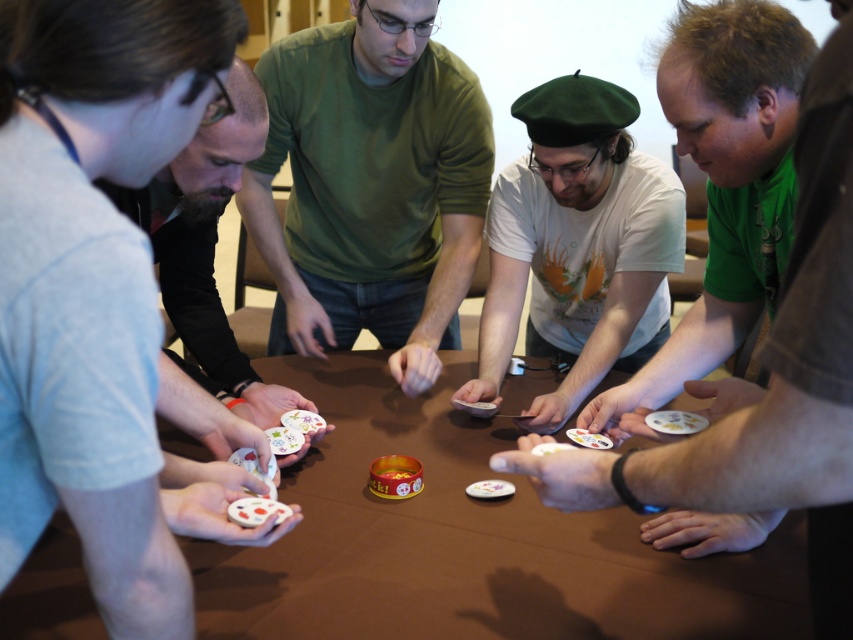
You are standing at the edge of the table and want to place a 1.2 meter long ruler from your current position to the point labeled point (386, 563). Will the ruler reach that point?

The distance between you and point (386, 563) is 1.08 meters, which is shorter than the ruler length of 1.2 meters. Therefore, the ruler will reach the point.

You are a person standing at the edge of the room looking towards the brown matte table at center and the smooth gray shirt at left. Which object is closer to the floor?

The brown matte table at center is shorter than the smooth gray shirt at left, so the brown matte table at center is closer to the floor.

Where is the brown matte table at center located in the image?

The brown matte table at center is located at point (467, 541) in the image.